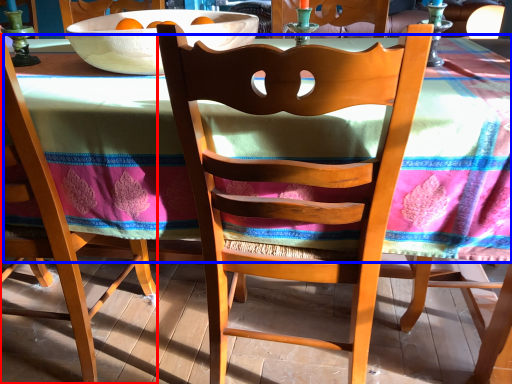
Question: Which object appears closest to the camera in this image, chair (highlighted by a red box) or tablecloth (highlighted by a blue box)?

Choices:
 (A) chair
 (B) tablecloth

Answer: (B)